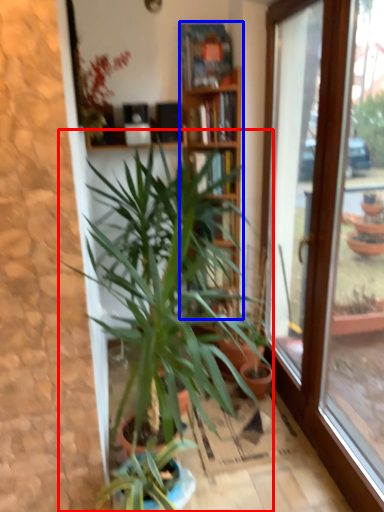
Question: Which of the following is the farthest to the observer, houseplant (highlighted by a red box) or bookcase (highlighted by a blue box)?

Choices:
 (A) houseplant
 (B) bookcase

Answer: (B)